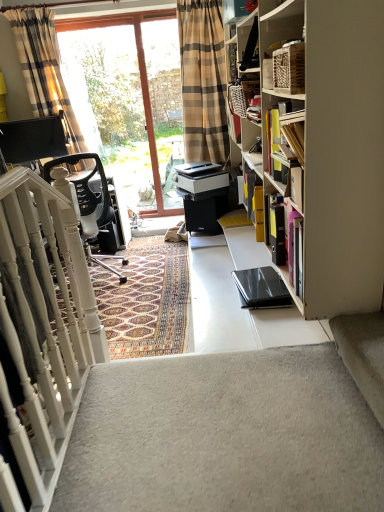
Question: From a real-world perspective, does transparent glass screen door at upper left sit lower than transparent glass window at upper center?

Choices:
 (A) no
 (B) yes

Answer: (A)

Question: From a real-world perspective, is transparent glass screen door at upper left over transparent glass window at upper center?

Choices:
 (A) yes
 (B) no

Answer: (A)

Question: Is transparent glass screen door at upper left taller than transparent glass window at upper center?

Choices:
 (A) no
 (B) yes

Answer: (A)

Question: Is transparent glass screen door at upper left facing towards transparent glass window at upper center?

Choices:
 (A) no
 (B) yes

Answer: (A)

Question: Could transparent glass window at upper center be considered to be inside transparent glass screen door at upper left?

Choices:
 (A) no
 (B) yes

Answer: (A)

Question: Is white painted wood stairs at left to the left or to the right of transparent glass window at upper center in the image?

Choices:
 (A) left
 (B) right

Answer: (B)

Question: Considering the positions of white painted wood stairs at left and transparent glass window at upper center in the image, is white painted wood stairs at left bigger or smaller than transparent glass window at upper center?

Choices:
 (A) small
 (B) big

Answer: (A)

Question: Considering the positions of point click(99, 349) and point click(112, 57), is point click(99, 349) closer or farther from the camera than point click(112, 57)?

Choices:
 (A) closer
 (B) farther

Answer: (A)

Question: In terms of height, does white painted wood stairs at left look taller or shorter compared to transparent glass window at upper center?

Choices:
 (A) short
 (B) tall

Answer: (A)

Question: Considering the positions of transparent glass screen door at upper left and black mesh office chair at left in the image, is transparent glass screen door at upper left bigger or smaller than black mesh office chair at left?

Choices:
 (A) small
 (B) big

Answer: (A)

Question: Considering the positions of point (147, 69) and point (94, 201), is point (147, 69) closer or farther from the camera than point (94, 201)?

Choices:
 (A) closer
 (B) farther

Answer: (B)

Question: Is transparent glass screen door at upper left taller or shorter than black mesh office chair at left?

Choices:
 (A) tall
 (B) short

Answer: (A)

Question: In the image, is transparent glass screen door at upper left positioned in front of or behind black mesh office chair at left?

Choices:
 (A) front
 (B) behind

Answer: (B)

Question: Considering the positions of point (52, 22) and point (153, 25), is point (52, 22) closer or farther from the camera than point (153, 25)?

Choices:
 (A) closer
 (B) farther

Answer: (A)

Question: Is plaid fabric curtain at upper left taller or shorter than transparent glass window at upper center?

Choices:
 (A) short
 (B) tall

Answer: (A)